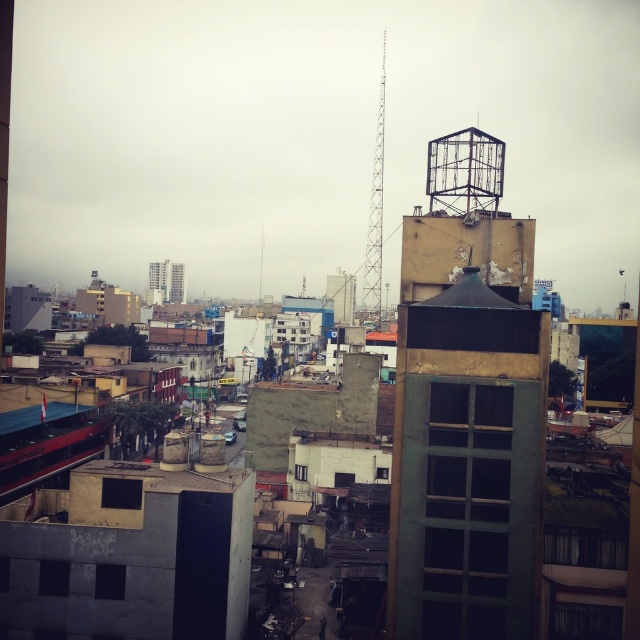
Can you confirm if rusty metal tower at upper right is smaller than smooth concrete building at center?

Yes, rusty metal tower at upper right is smaller than smooth concrete building at center.

Is point (420, 216) closer to camera compared to point (163, 284)?

Yes, it is.

Find the location of a particular element. rusty metal tower at upper right is located at coordinates (467, 410).